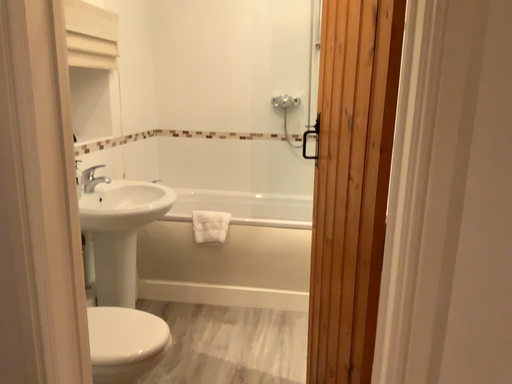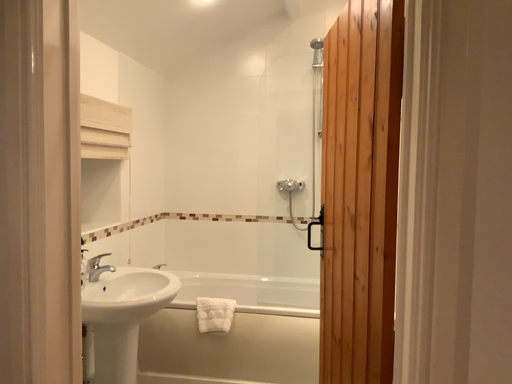
Question: How did the camera likely rotate when shooting the video?

Choices:
 (A) rotated upward
 (B) rotated downward

Answer: (A)